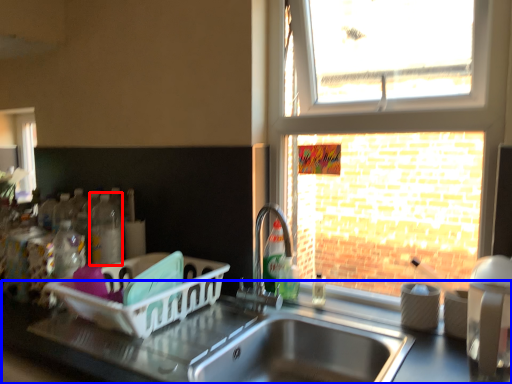
Question: Among these objects, which one is farthest to the camera, bottle (highlighted by a red box) or counter top (highlighted by a blue box)?

Choices:
 (A) bottle
 (B) counter top

Answer: (A)